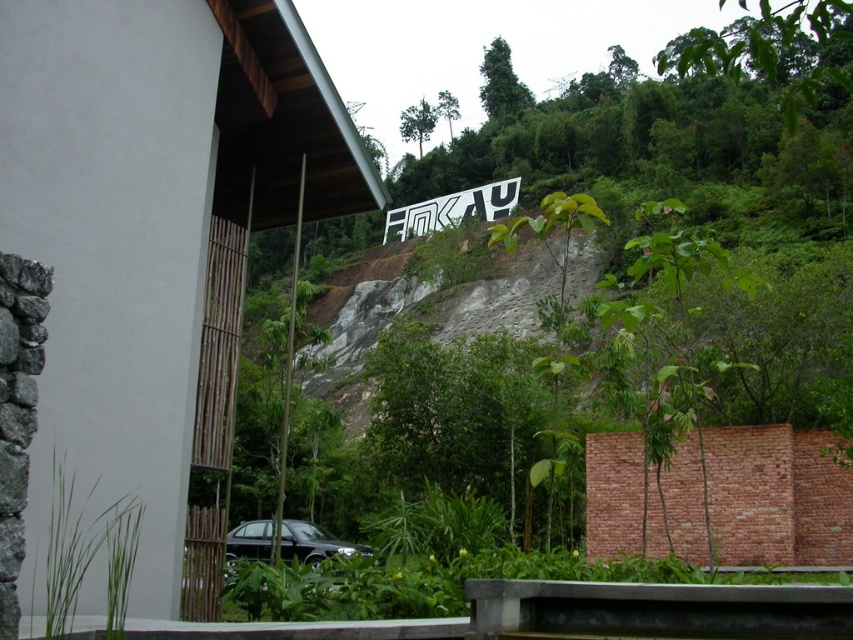
Question: Can you confirm if white metallic sign at upper center is smaller than shiny black car at lower center?

Choices:
 (A) yes
 (B) no

Answer: (B)

Question: Which point is closer to the camera?

Choices:
 (A) (253, 524)
 (B) (424, 208)

Answer: (A)

Question: Which object appears closest to the camera in this image?

Choices:
 (A) shiny black car at lower center
 (B) white metallic sign at upper center

Answer: (A)

Question: Considering the relative positions of white metallic sign at upper center and shiny black car at lower center in the image provided, where is white metallic sign at upper center located with respect to shiny black car at lower center?

Choices:
 (A) below
 (B) above

Answer: (B)

Question: Does white metallic sign at upper center have a larger size compared to shiny black car at lower center?

Choices:
 (A) yes
 (B) no

Answer: (A)